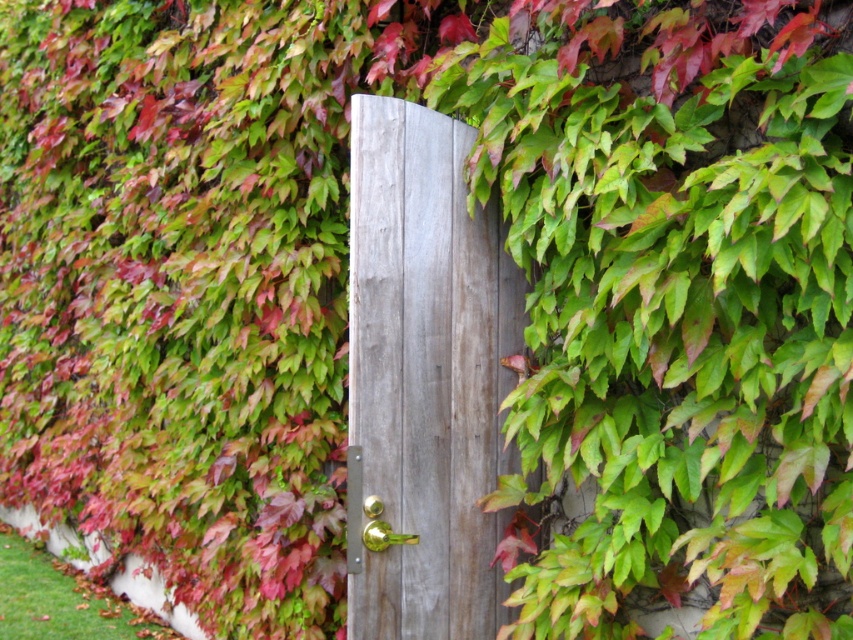
Question: Does gray wood door at center have a lesser width compared to gold metallic door handle at center?

Choices:
 (A) yes
 (B) no

Answer: (B)

Question: Which point is closer to the camera taking this photo?

Choices:
 (A) (364, 531)
 (B) (434, 596)

Answer: (A)

Question: Which point appears closest to the camera in this image?

Choices:
 (A) (500, 234)
 (B) (381, 538)

Answer: (B)

Question: Does gray wood door at center have a lesser width compared to gold metallic door handle at center?

Choices:
 (A) yes
 (B) no

Answer: (B)

Question: Is gray wood door at center further to the viewer compared to gold metallic door handle at center?

Choices:
 (A) yes
 (B) no

Answer: (A)